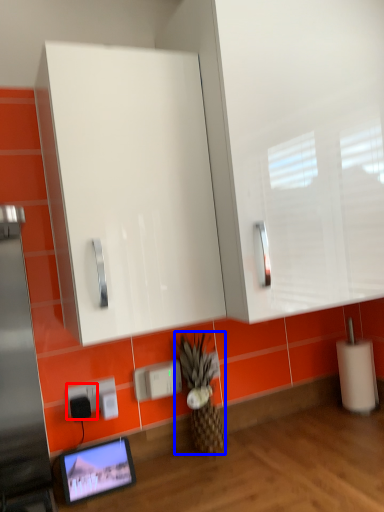
Question: Among these objects, which one is farthest to the camera, electric outlet (highlighted by a red box) or pineapple (highlighted by a blue box)?

Choices:
 (A) electric outlet
 (B) pineapple

Answer: (B)